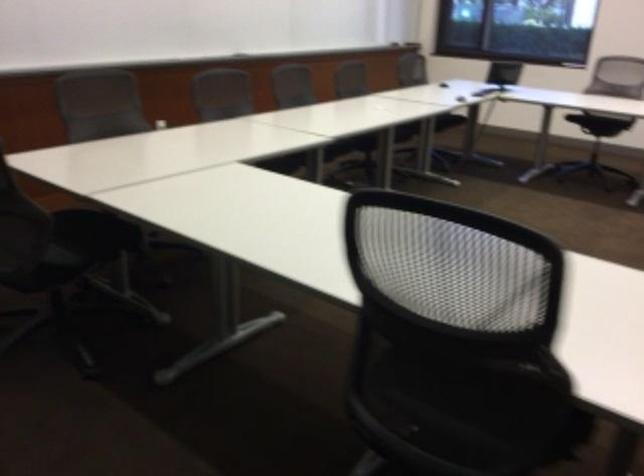
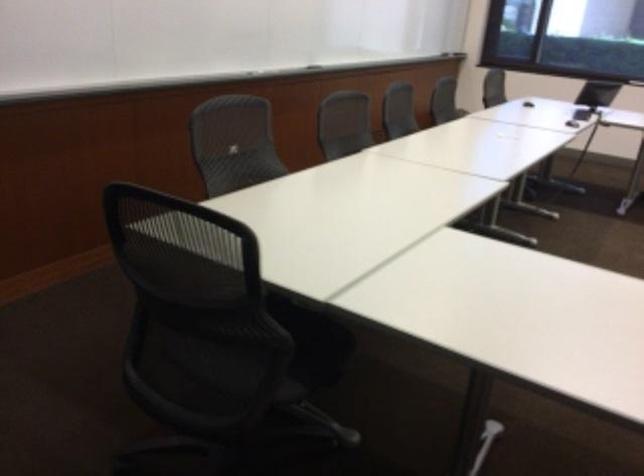
Find the pixel in the second image that matches [102,236] in the first image.

(314, 341)